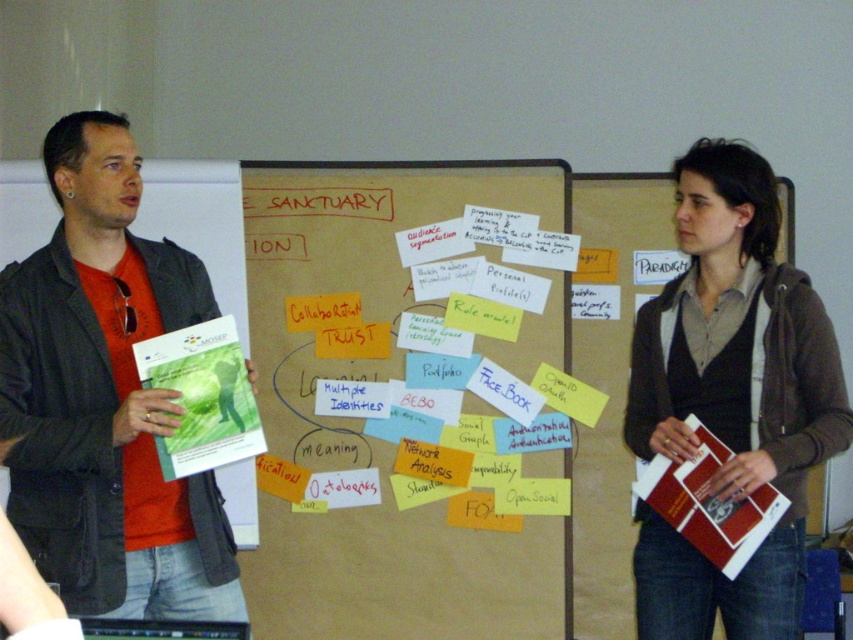
Based on the scene description, where is the brown paper bulletin board at center located in the image?

The brown paper bulletin board at center is located at point coordinates of (408, 397).

You are standing in the classroom and want to place a new poster on the wall. The bulletin board is at point (408, 397). Where exactly should you place the poster?

The brown paper bulletin board at center is located at point (408, 397), so you should place the poster there.

You are organizing a clothing donation drive and need to determine which items can fit into a standard donation bin that is 1 meter wide. Based on the scene, will the matte black jacket at left and the brown textured sweater at center both fit side by side in the bin?

The matte black jacket at left is wider than the brown textured sweater at center. Since the bin is 1 meter wide, you need to check the combined width of both items. However, the description only states the relative width between them, not their exact measurements. Without knowing their exact widths, it is impossible to determine if they will fit together in the bin.